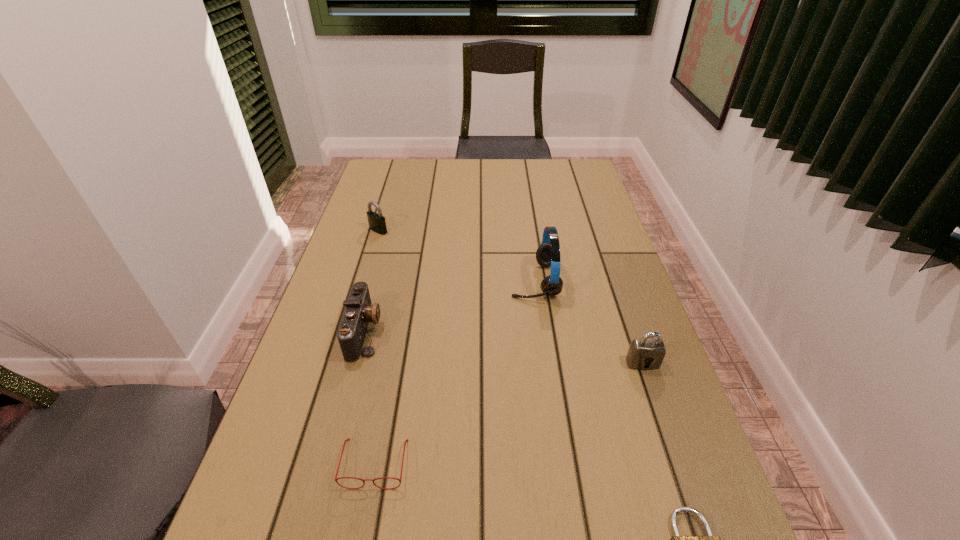
Locate an element on the screen. This screenshot has height=540, width=960. vacant space located with the microphone attached to the side of the tallest object is located at coordinates (485, 281).

At what (x,y) coordinates should I click in order to perform the action: click on free space located 0.400m on the front of the leftmost padlock. Please return your answer as a coordinate pair (x, y). Looking at the image, I should click on (348, 330).

Identify the location of blank area located at the front of the second nearest padlock near the keyhole. This screenshot has height=540, width=960. tap(679, 467).

Locate an element on the screen. This screenshot has height=540, width=960. free space located 0.120m on the front-facing side of the camera is located at coordinates (430, 332).

Where is `padlock that is at the left edge`? This screenshot has height=540, width=960. padlock that is at the left edge is located at coordinates (377, 223).

You are a GUI agent. You are given a task and a screenshot of the screen. Output one action in this format:
    pyautogui.click(x=<x>, y=<y>)
    Task: Click on the camera located in the left edge section of the desktop
    The height and width of the screenshot is (540, 960).
    Given the screenshot: What is the action you would take?
    (x=359, y=312)

The height and width of the screenshot is (540, 960). Identify the location of spectacles that is at the left edge. (348, 439).

I want to click on object present at the right edge, so click(647, 353).

Locate an element on the screen. The height and width of the screenshot is (540, 960). free region at the far edge of the desktop is located at coordinates (449, 164).

Image resolution: width=960 pixels, height=540 pixels. I want to click on vacant space at the left edge of the desktop, so click(x=396, y=207).